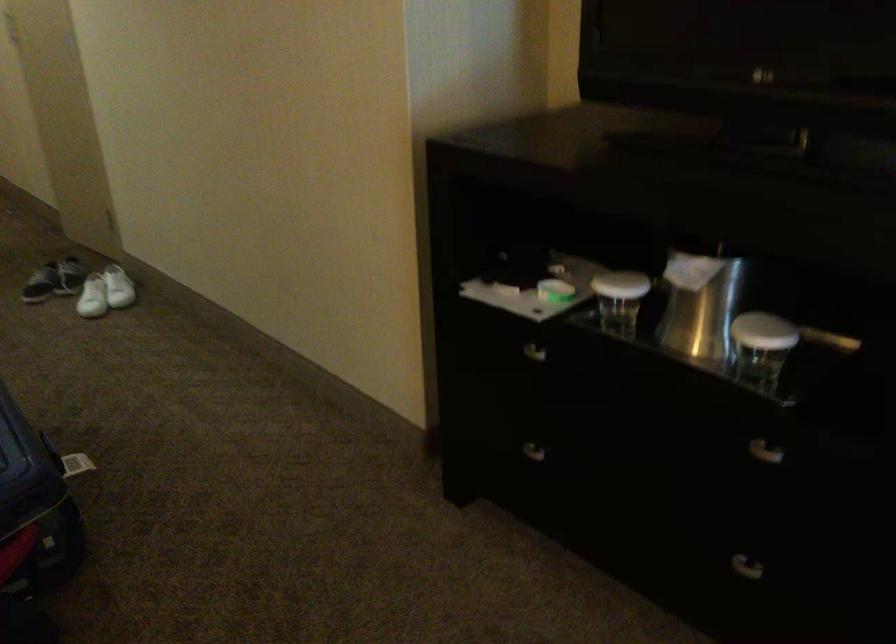
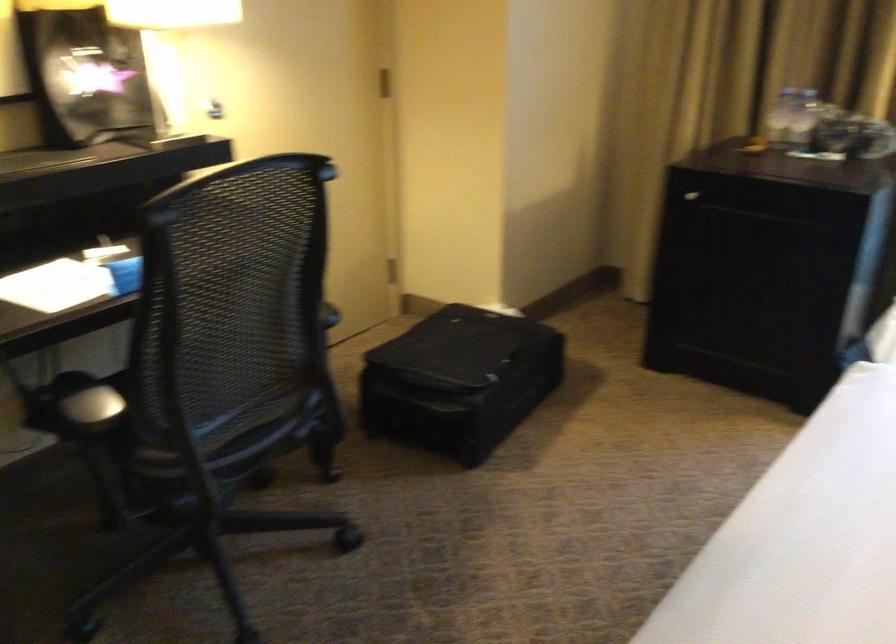
First-person continuous shooting, in which direction is the camera rotating?

The rotation direction of the camera is right-down.